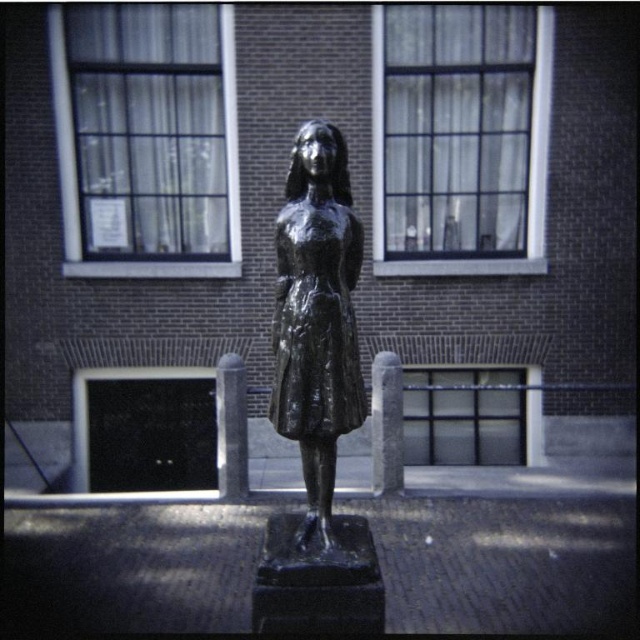
You are a painter standing 3 feet away from the bronze statue at center and the shiny black dress at center. You want to paint both objects on a canvas. Since you need to focus on one object at a time, which object should you paint first if you want to paint the one closer to you?

Both the bronze statue at center and the shiny black dress at center are at the same distance from you since they are positioned at the center of the image. The distance between them is 1.69 inches, but this does not affect their distance from your position.

You are standing at point (316, 316) in the image. What object is located exactly at this point?

The bronze statue at center is located exactly at point (316, 316).

You are an art curator planning to display the bronze statue at center and the shiny black dress at center in a gallery. The gallery has a narrow corridor that can only accommodate items with a width of 1.2 meters or less. Based on the image, can both items fit through the corridor together?

The bronze statue at center has a lesser width compared to shiny black dress at center. Since the corridor can only accommodate items up to 1.2 meters wide, the bronze statue might fit, but the shiny black dress may be too wide. They cannot both fit through the corridor together if the dress exceeds the width limit.